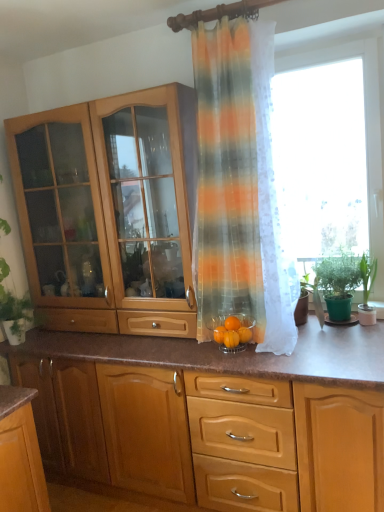
Identify the location of free spot to the right of orange matte glass bowl at center, the second orange viewed from the left. (301, 343).